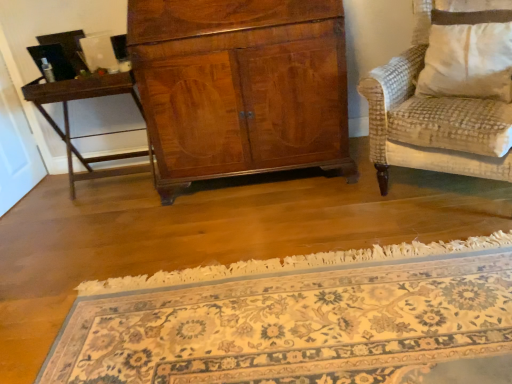
Question: Based on their positions, is dark brown wood table at left located to the left or right of floral carpet at center?

Choices:
 (A) left
 (B) right

Answer: (A)

Question: From the image's perspective, is dark brown wood table at left located above or below floral carpet at center?

Choices:
 (A) above
 (B) below

Answer: (A)

Question: Estimate the real-world distances between objects in this image. Which object is farther from the dark brown wood table at left?

Choices:
 (A) white textured pillow at right
 (B) floral carpet at center

Answer: (A)

Question: Which is farther from the floral carpet at center?

Choices:
 (A) white textured pillow at right
 (B) dark brown wood table at left

Answer: (B)